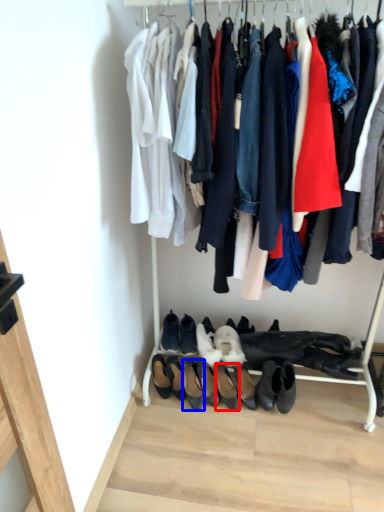
Question: Among these objects, which one is nearest to the camera, footwear (highlighted by a red box) or footwear (highlighted by a blue box)?

Choices:
 (A) footwear
 (B) footwear

Answer: (A)